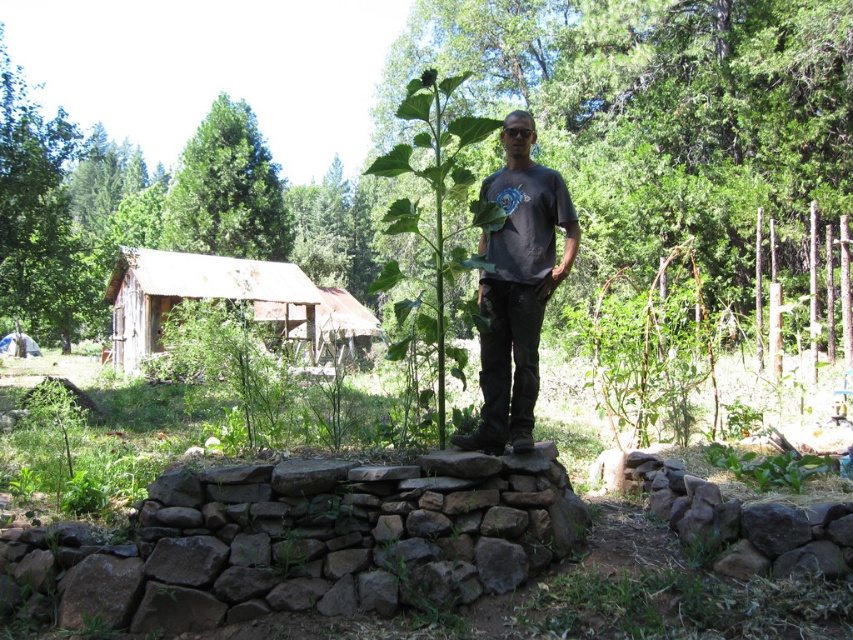
Which is below, dark gray t-shirt at center or rusty wood cabin at left?

dark gray t-shirt at center

You are a GUI agent. You are given a task and a screenshot of the screen. Output one action in this format:
    pyautogui.click(x=<x>, y=<y>)
    Task: Click on the dark gray t-shirt at center
    
    Given the screenshot: What is the action you would take?
    pyautogui.click(x=517, y=285)

Who is more forward, [480,241] or [175,296]?

Point [480,241] is in front.

The image size is (853, 640). I want to click on dark gray t-shirt at center, so [517, 285].

Which of these two, dark gray t-shirt at center or green leafy tree at upper left, stands taller?

green leafy tree at upper left

Between point (531, 179) and point (283, 260), which one is positioned in front?

Positioned in front is point (531, 179).

The width and height of the screenshot is (853, 640). Identify the location of dark gray t-shirt at center. tap(517, 285).

Who is higher up, green leafy tree at upper left or rusty wood cabin at left?

green leafy tree at upper left

At what (x,y) coordinates should I click in order to perform the action: click on green leafy tree at upper left. Please return your answer as a coordinate pair (x, y). The image size is (853, 640). Looking at the image, I should click on (225, 189).